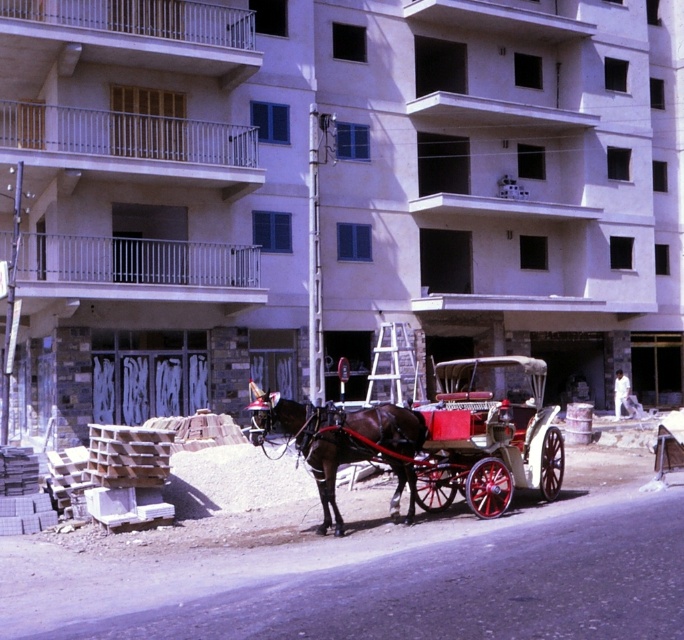
Question: Can you confirm if polished wood horse cart at center is smaller than shiny brown horse at center?

Choices:
 (A) no
 (B) yes

Answer: (A)

Question: Which point is farther to the camera?

Choices:
 (A) shiny brown horse at center
 (B) polished wood horse cart at center

Answer: (B)

Question: Can you confirm if polished wood horse cart at center is positioned below shiny brown horse at center?

Choices:
 (A) no
 (B) yes

Answer: (A)

Question: Can you confirm if polished wood horse cart at center is positioned to the left of shiny brown horse at center?

Choices:
 (A) yes
 (B) no

Answer: (B)